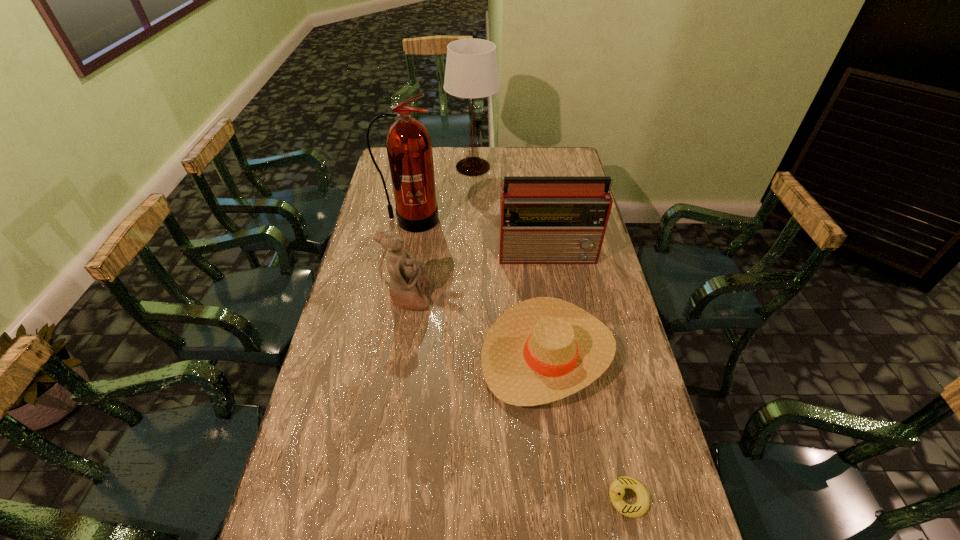
Identify the location of free space located on the front-facing side of the figurine. The height and width of the screenshot is (540, 960). (517, 296).

Locate an element on the screen. The height and width of the screenshot is (540, 960). vacant area situated 0.330m on the left of the sunhat is located at coordinates (370, 355).

Image resolution: width=960 pixels, height=540 pixels. I want to click on free space located 0.190m on the face of the duckling, so click(x=524, y=498).

I want to click on vacant space located 0.260m on the face of the duckling, so click(493, 498).

At what (x,y) coordinates should I click in order to perform the action: click on free region located 0.350m on the face of the duckling. Please return your answer as a coordinate pair (x, y). Looking at the image, I should click on [455, 498].

Identify the location of object at the far edge. (471, 71).

Find the location of a particular element. fire extinguisher present at the left edge is located at coordinates (409, 147).

Find the location of a particular element. The width and height of the screenshot is (960, 540). figurine that is at the left edge is located at coordinates (408, 279).

Find the location of `radio receiver situated at the right edge`. radio receiver situated at the right edge is located at coordinates (543, 219).

Where is `sunhat that is at the right edge`? Image resolution: width=960 pixels, height=540 pixels. sunhat that is at the right edge is located at coordinates (543, 349).